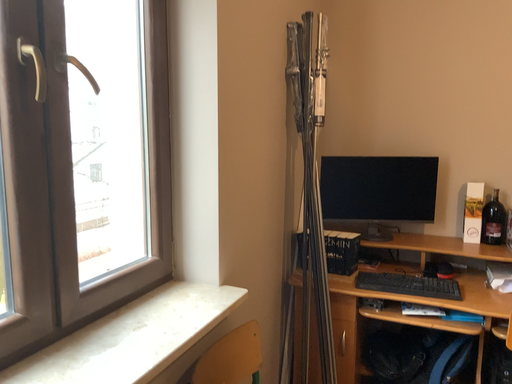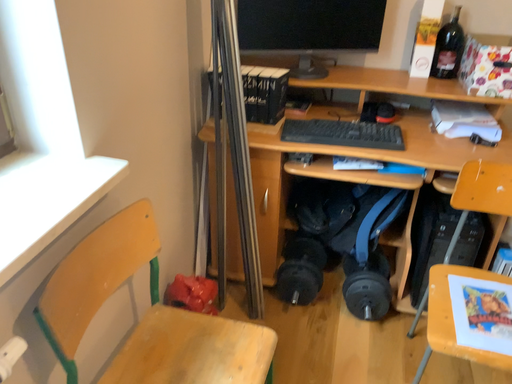
Question: How did the camera likely rotate when shooting the video?

Choices:
 (A) rotated right
 (B) rotated left

Answer: (A)